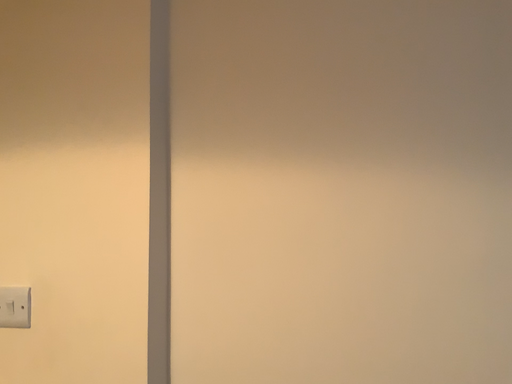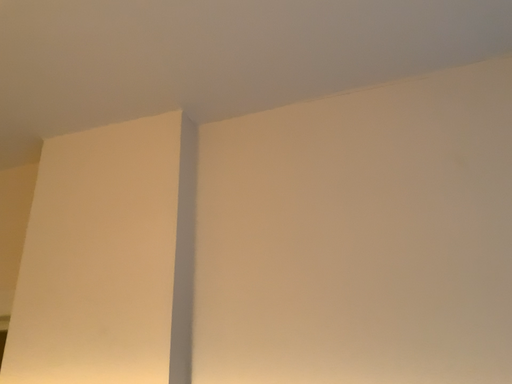
Question: Which way did the camera rotate in the video?

Choices:
 (A) rotated downward
 (B) rotated upward

Answer: (B)